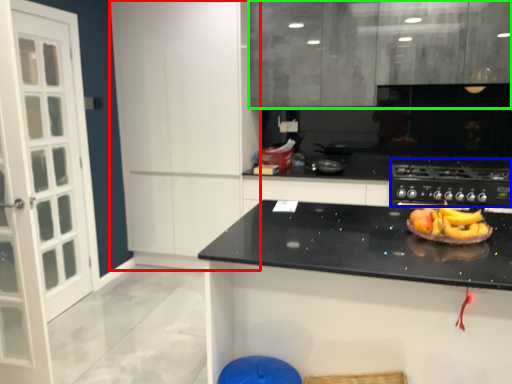
Question: Which object is positioned farthest from cabinetry (highlighted by a red box)? Select from gas stove (highlighted by a blue box) and cabinetry (highlighted by a green box).

Choices:
 (A) gas stove
 (B) cabinetry

Answer: (A)